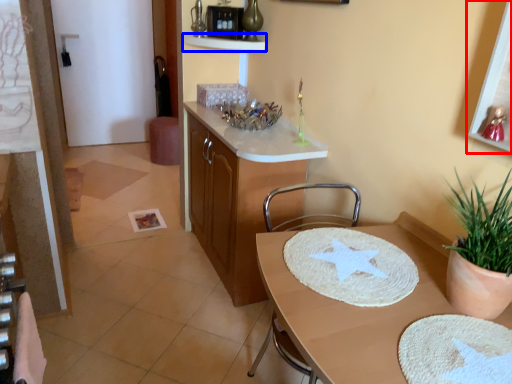
Question: Which object appears farthest to the camera in this image, picture frame (highlighted by a red box) or shelf (highlighted by a blue box)?

Choices:
 (A) picture frame
 (B) shelf

Answer: (B)